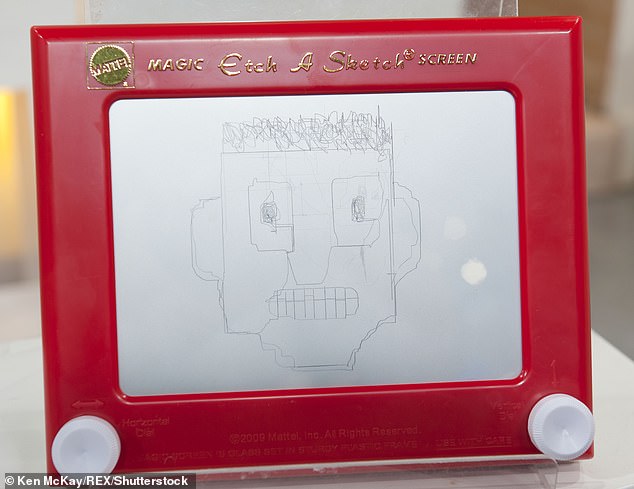
Identify the location of right knob. (558, 435).